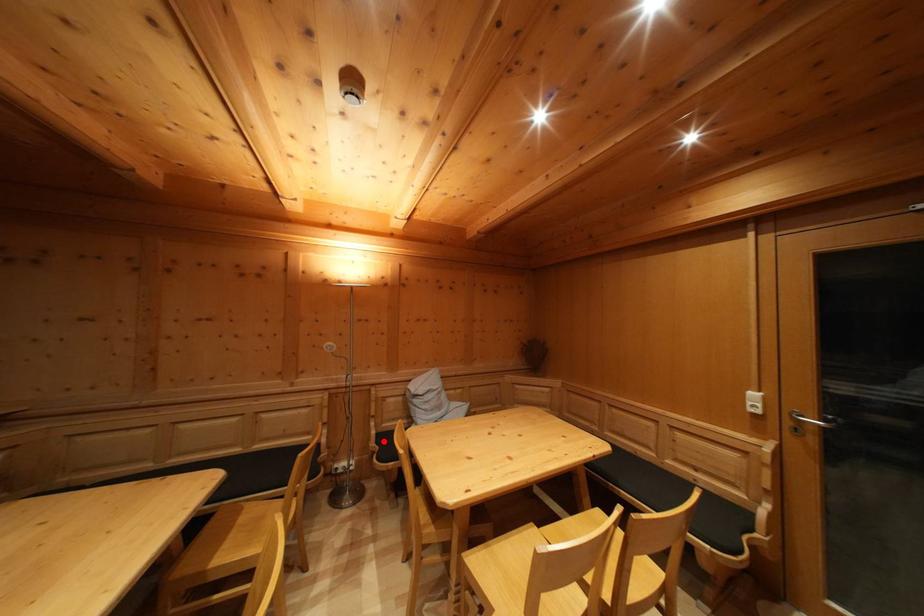
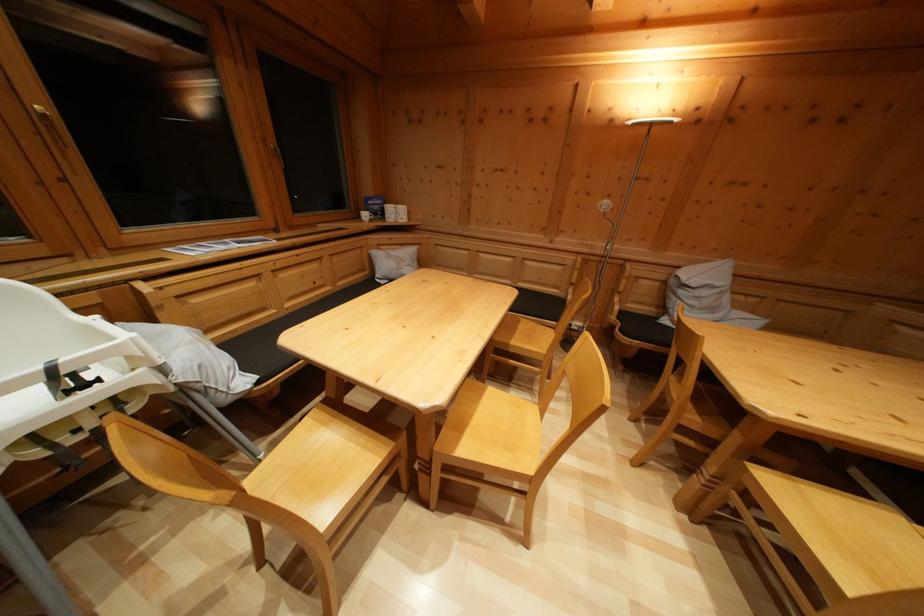
In the second image, find the point that corresponds to the highlighted location in the first image.

(626, 318)